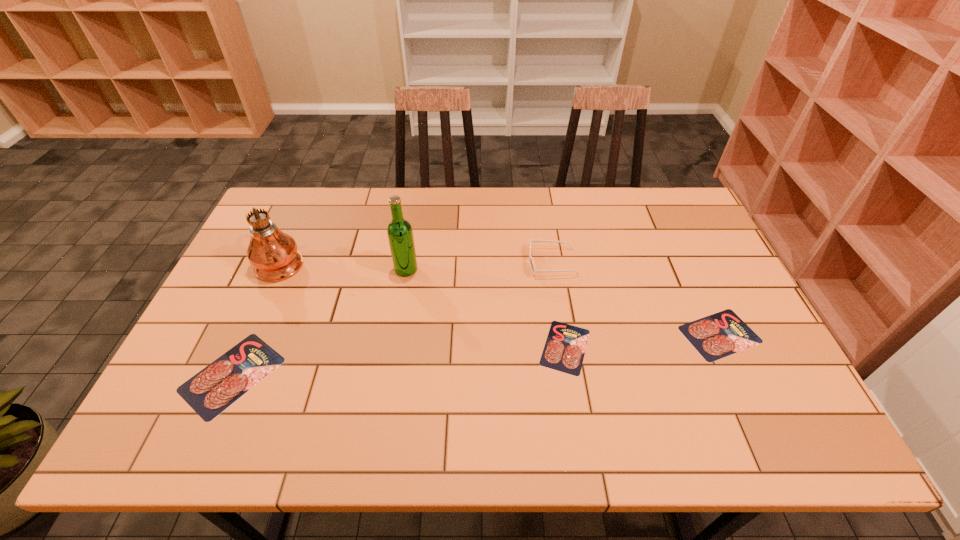
Find the location of `object at the near left corner`. object at the near left corner is located at coordinates (212, 390).

Where is `vacant region at the far edge of the desktop`? This screenshot has width=960, height=540. vacant region at the far edge of the desktop is located at coordinates (636, 227).

At what (x,y) coordinates should I click in order to perform the action: click on free region at the near edge of the desktop. Please return your answer as a coordinate pair (x, y). The image size is (960, 540). Looking at the image, I should click on (716, 399).

This screenshot has height=540, width=960. Find the location of `free space at the left edge`. free space at the left edge is located at coordinates (263, 313).

In the image, there is a desktop. At what (x,y) coordinates should I click in order to perform the action: click on blank space at the right edge. Please return your answer as a coordinate pair (x, y). Looking at the image, I should click on (712, 250).

This screenshot has width=960, height=540. In the image, there is a desktop. In order to click on vacant space at the far left corner in this screenshot , I will do `click(293, 193)`.

What are the coordinates of `vacant region at the far right corner` in the screenshot? It's located at (683, 204).

Find the location of a particular element. Image resolution: width=960 pixels, height=540 pixels. free space between the rightmost object and the tallest object is located at coordinates 500,298.

This screenshot has height=540, width=960. I want to click on free space between the leftmost salami and the shortest salami, so click(398, 361).

Identify the location of vacant point located between the beer bottle and the fifth tallest object. (563, 302).